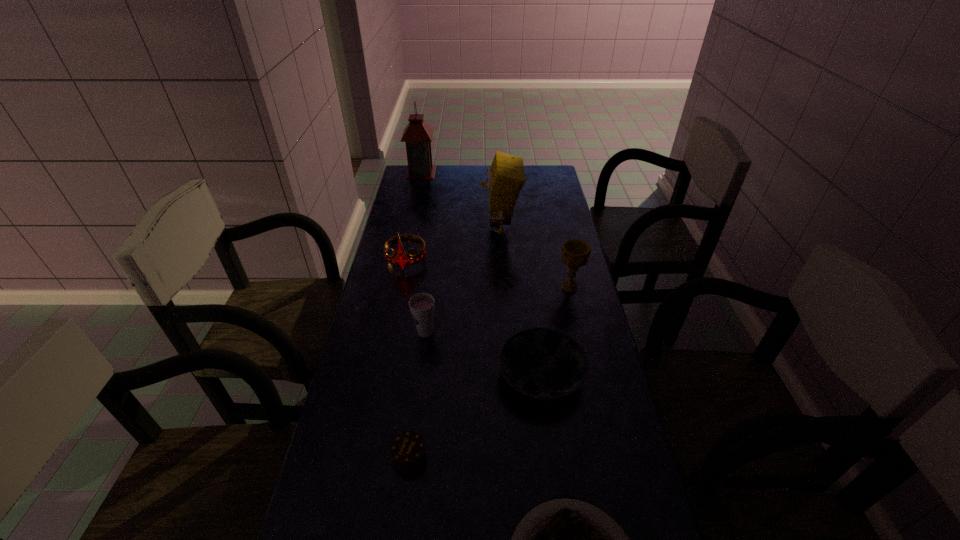
I want to click on the farthest object, so click(x=418, y=134).

The image size is (960, 540). Find the location of `sponge`. sponge is located at coordinates (506, 177).

Identify the location of the seventh nearest object. Image resolution: width=960 pixels, height=540 pixels. (506, 177).

This screenshot has height=540, width=960. Find the location of `the third farthest object`. the third farthest object is located at coordinates (401, 259).

Find the location of a particular element. chalice is located at coordinates (575, 253).

Where is `cup`? This screenshot has height=540, width=960. cup is located at coordinates (422, 306).

You are a GUI agent. You are given a task and a screenshot of the screen. Output one action in this format:
    pyautogui.click(x=<x>, y=<y>)
    Task: Click on the taller plate
    
    Given the screenshot: What is the action you would take?
    pyautogui.click(x=541, y=363)

The image size is (960, 540). I want to click on chocolate cake, so click(x=408, y=450).

Locate an element on the screen. The height and width of the screenshot is (540, 960). free point located 0.200m on the right of the farthest object is located at coordinates (477, 172).

Locate an element on the screen. free space located 0.230m on the face of the sponge is located at coordinates (421, 229).